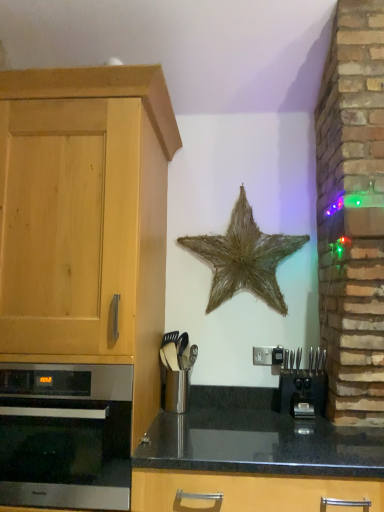
What do you see at coordinates (302, 385) in the screenshot? Image resolution: width=384 pixels, height=512 pixels. I see `black plastic coffee machine at lower right` at bounding box center [302, 385].

What is the approximate height of satin silver oven at left?

It is 18.65 inches.

Describe the element at coordinates (245, 257) in the screenshot. The height and width of the screenshot is (512, 384). I see `rustic straw star at center` at that location.

What is the approximate width of black granite countertop at center?

black granite countertop at center is 29.00 inches wide.

What is the approximate height of light wood cabinet at left?

It is 6.10 feet.

Locate an element on the screen. Image resolution: width=384 pixels, height=512 pixels. black plastic coffee machine at lower right is located at coordinates (302, 385).

Which object is positioned more to the right, metallic silver utensil holder at center or rustic straw star at center?

rustic straw star at center is more to the right.

In terms of width, does metallic silver utensil holder at center look wider or thinner when compared to rustic straw star at center?

Clearly, metallic silver utensil holder at center has more width compared to rustic straw star at center.

From a real-world perspective, is metallic silver utensil holder at center physically located above or below rustic straw star at center?

From a real-world perspective, metallic silver utensil holder at center is physically below rustic straw star at center.

Is metallic silver utensil holder at center facing away from rustic straw star at center?

No.

Considering the sizes of objects black plastic coffee machine at lower right and light wood cabinet at left in the image provided, who is smaller, black plastic coffee machine at lower right or light wood cabinet at left?

Smaller between the two is black plastic coffee machine at lower right.

Is black plastic coffee machine at lower right looking in the opposite direction of light wood cabinet at left?

No, black plastic coffee machine at lower right's orientation is not away from light wood cabinet at left.

From the picture: Is black plastic coffee machine at lower right not within light wood cabinet at left?

Yes.

Is point (302, 382) more distant than point (36, 187)?

Yes, point (302, 382) is behind point (36, 187).

Who is shorter, satin silver oven at left or light wood cabinet at left?

Standing shorter between the two is satin silver oven at left.

From the image's perspective, is satin silver oven at left located beneath light wood cabinet at left?

Indeed, from the image's perspective, satin silver oven at left is shown beneath light wood cabinet at left.

Is point (24, 475) positioned behind point (12, 284)?

No, it is in front of (12, 284).

How distant is black granite countertop at center from light wood cabinet at left?

A distance of 28.53 inches exists between black granite countertop at center and light wood cabinet at left.

How different are the orientations of black granite countertop at center and light wood cabinet at left in degrees?

The angle between the facing direction of black granite countertop at center and the facing direction of light wood cabinet at left is 0.00138 degrees.

Considering the positions of objects black granite countertop at center and light wood cabinet at left in the image provided, who is more to the left, black granite countertop at center or light wood cabinet at left?

Positioned to the left is light wood cabinet at left.

Is black granite countertop at center beside light wood cabinet at left?

No.

Where is `countertop to the left of black plastic coffee machine at lower right`? countertop to the left of black plastic coffee machine at lower right is located at coordinates (257, 438).

Between point (181, 441) and point (326, 377), which one is positioned in front?

Positioned in front is point (326, 377).

Would you say black granite countertop at center is a long distance from black plastic coffee machine at lower right?

They are positioned close to each other.

Considering the sizes of objects black granite countertop at center and black plastic coffee machine at lower right in the image provided, who is wider, black granite countertop at center or black plastic coffee machine at lower right?

black granite countertop at center is wider.

Does rustic straw star at center have a larger size compared to light wood cabinet at left?

Actually, rustic straw star at center might be smaller than light wood cabinet at left.

Is rustic straw star at center at the left side of light wood cabinet at left?

No, rustic straw star at center is not to the left of light wood cabinet at left.

From the image's perspective, which is above, rustic straw star at center or light wood cabinet at left?

rustic straw star at center.

Which object is positioned more to the left, rustic straw star at center or black granite countertop at center?

rustic straw star at center is more to the left.

From the image's perspective, does rustic straw star at center appear lower than black granite countertop at center?

No, from the image's perspective, rustic straw star at center is not beneath black granite countertop at center.

I want to click on starfish above the black granite countertop at center (from the image's perspective), so click(245, 257).

This screenshot has width=384, height=512. I want to click on starfish on the right of metallic silver utensil holder at center, so click(x=245, y=257).

You are a GUI agent. You are given a task and a screenshot of the screen. Output one action in this format:
    pyautogui.click(x=<x>, y=<y>)
    Task: Click on the coffee machine below the light wood cabinet at left (from the image's perspective)
    The image size is (384, 512).
    Given the screenshot: What is the action you would take?
    pyautogui.click(x=302, y=385)

Which object lies further to the anchor point rustic straw star at center, metallic silver utensil holder at center or black granite countertop at center?

The object further to rustic straw star at center is black granite countertop at center.

Considering their positions, is black granite countertop at center positioned closer to black plastic coffee machine at lower right than light wood cabinet at left?

Among the two, black granite countertop at center is located nearer to black plastic coffee machine at lower right.

When comparing their distances from black granite countertop at center, does black plastic coffee machine at lower right or metallic silver utensil holder at center seem closer?

black plastic coffee machine at lower right lies closer to black granite countertop at center than the other object.

Estimate the real-world distances between objects in this image. Which object is further from satin silver oven at left, black plastic coffee machine at lower right or metallic silver utensil holder at center?

black plastic coffee machine at lower right is positioned further to the anchor satin silver oven at left.

Based on their spatial positions, is rustic straw star at center or black plastic coffee machine at lower right closer to light wood cabinet at left?

Among the two, rustic straw star at center is located nearer to light wood cabinet at left.

Based on their spatial positions, is metallic silver utensil holder at center or satin silver oven at left closer to black granite countertop at center?

The object closer to black granite countertop at center is metallic silver utensil holder at center.

When comparing their distances from black granite countertop at center, does light wood cabinet at left or black plastic coffee machine at lower right seem further?

light wood cabinet at left is further to black granite countertop at center.

Estimate the real-world distances between objects in this image. Which object is closer to metallic silver utensil holder at center, rustic straw star at center or black granite countertop at center?

black granite countertop at center is positioned closer to the anchor metallic silver utensil holder at center.

Identify the location of coffee machine between rustic straw star at center and black granite countertop at center in the vertical direction. (302, 385).

This screenshot has width=384, height=512. What are the coordinates of `starfish between light wood cabinet at left and black plastic coffee machine at lower right in the horizontal direction` in the screenshot? It's located at (245, 257).

Find the location of `oven positioned between light wood cabinet at left and metallic silver utensil holder at center from near to far`. oven positioned between light wood cabinet at left and metallic silver utensil holder at center from near to far is located at coordinates (65, 435).

Find the location of `appliance located between satin silver oven at left and black plastic coffee machine at lower right in the left-right direction`. appliance located between satin silver oven at left and black plastic coffee machine at lower right in the left-right direction is located at coordinates (x=176, y=370).